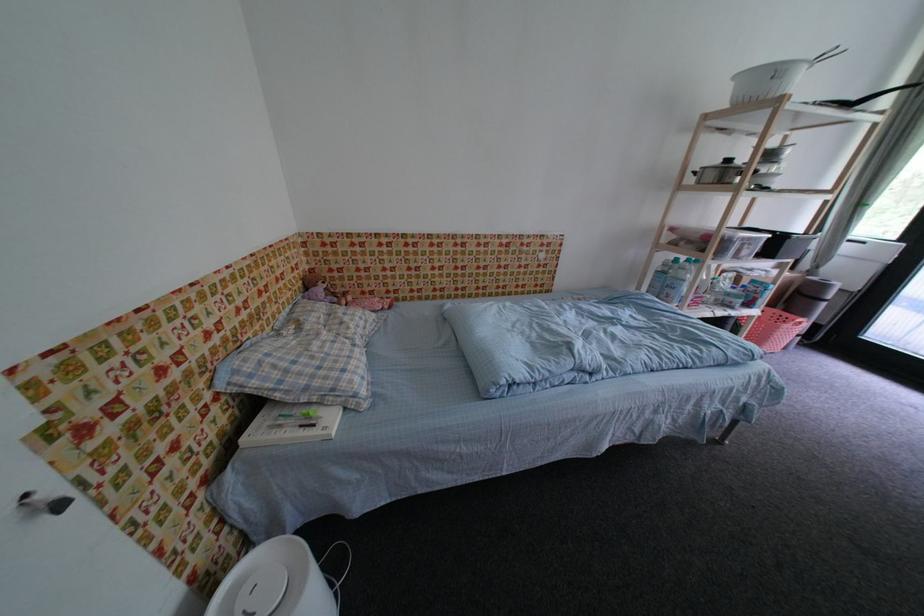
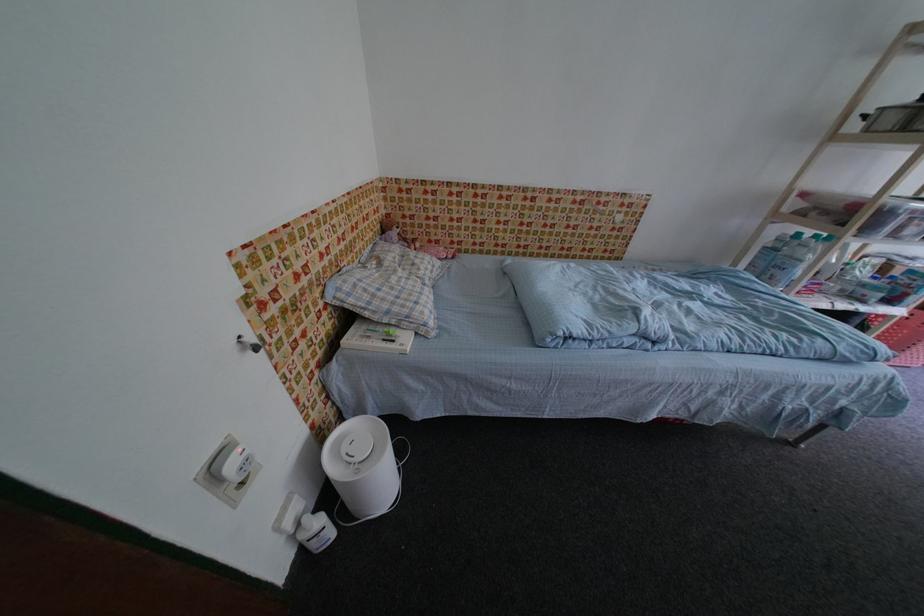
Where in the second image is the point corresponding to (317,406) from the first image?

(396, 328)